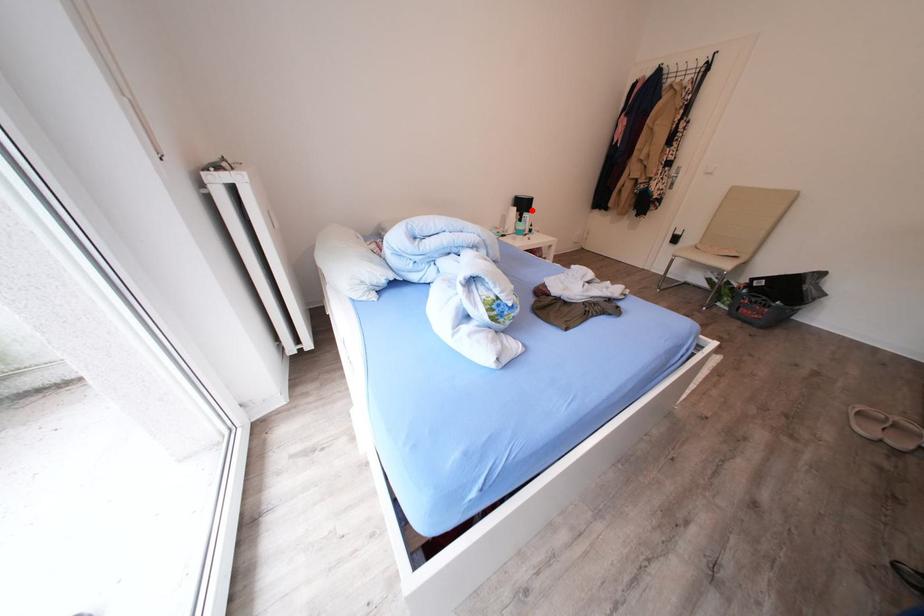
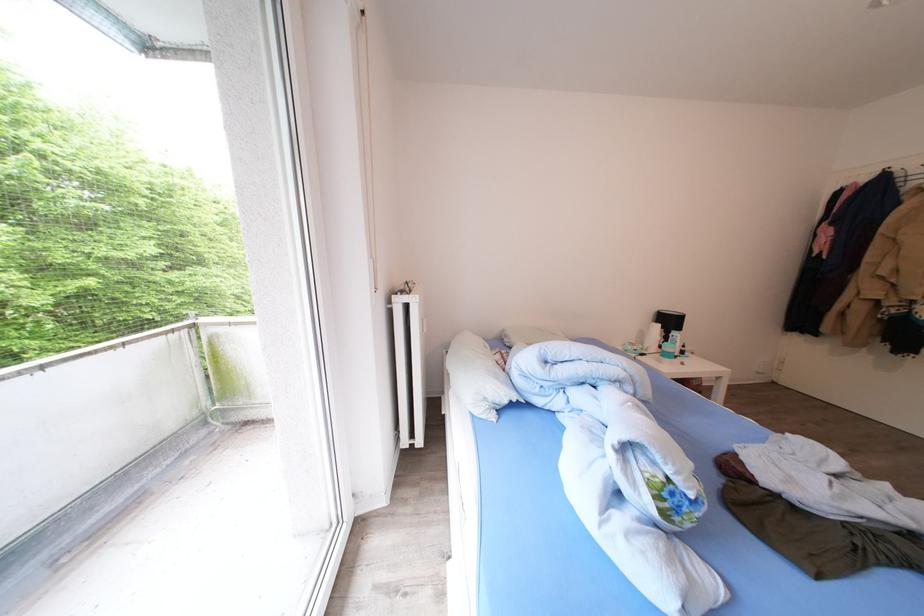
Question: I am providing you with two images of the same scene from different viewpoints. Image1 has a red point marked. In image2, the corresponding 3D location appears at what relative position? Reply with the corresponding letter.

Choices:
 (A) Closer
 (B) Farther

Answer: (B)